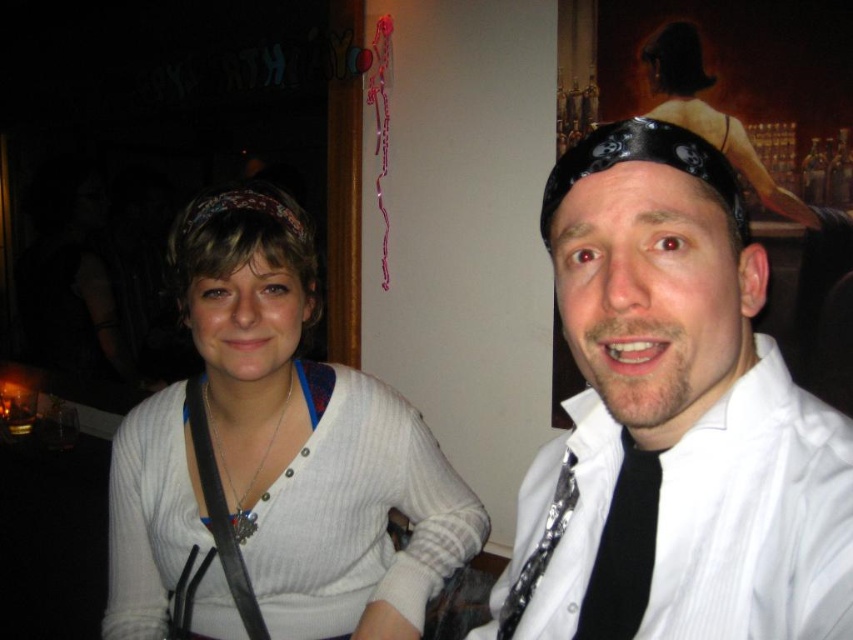
You are a photographer at a party and need to decide which item to focus on first between the white ribbed sweater at center and the black satin tie at center. Since you can only focus on one item at a time, which one should you choose to ensure the larger item is in focus?

The white ribbed sweater at center is bigger than the black satin tie at center, so you should focus on the white ribbed sweater at center first to ensure the larger item is in focus.

You are at a party and want to take a photo of the black satin tie at center and the white glossy shirt at upper right. Which one should you focus on first if you want to capture both in the same frame?

The white glossy shirt at upper right is positioned on the right side of the black satin tie at center, so you should focus on the black satin tie at center first to ensure both are in frame.

You are a photographer trying to frame a shot of the two people in the image. The white glossy shirt at upper right and the shiny silver tie at right are both in your viewfinder. Since you want to focus on the wider object, which one should you center your camera on?

The white glossy shirt at upper right is wider than the shiny silver tie at right, so you should center your camera on the white glossy shirt at upper right to focus on the wider object.